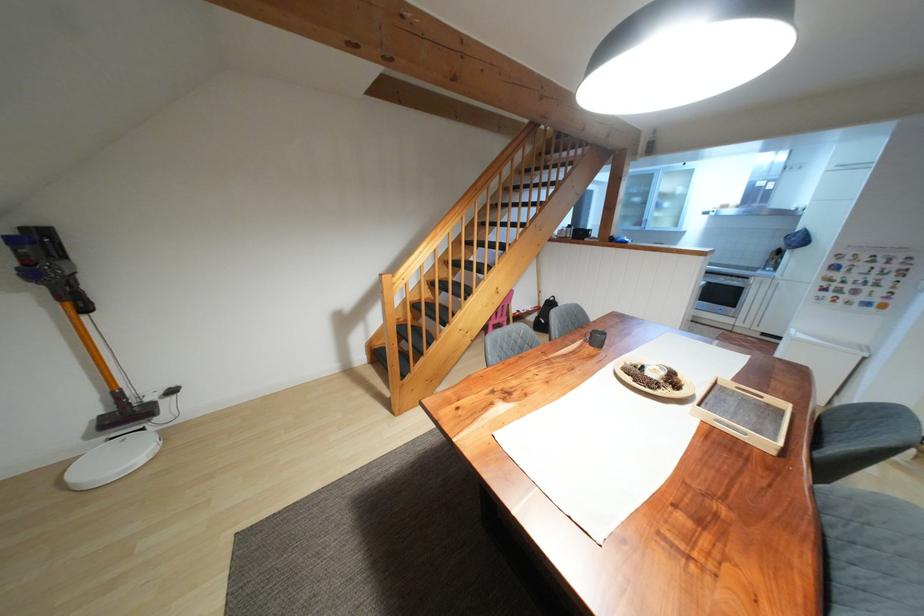
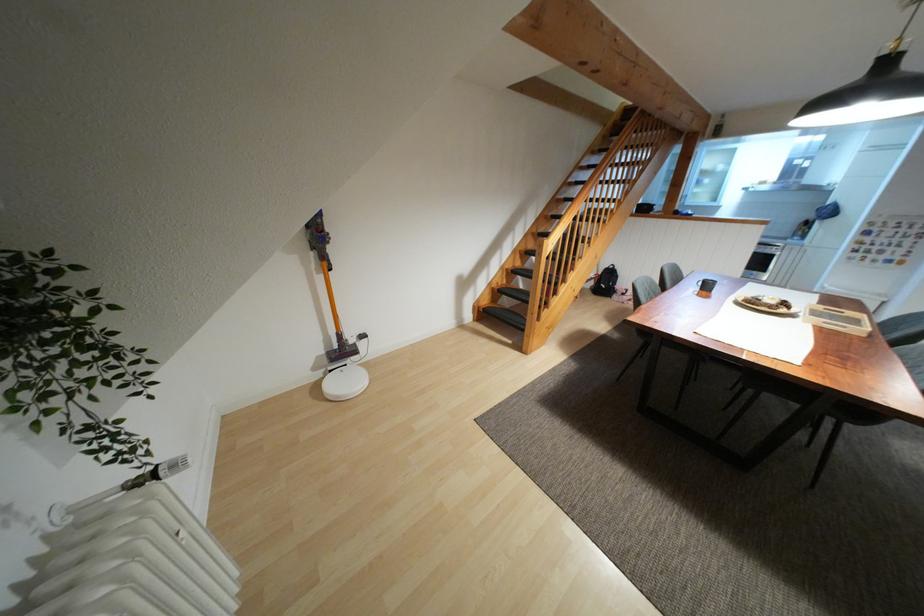
The images are taken continuously from a first-person perspective. In which direction are you moving?

The cameraman walked toward left, backward.